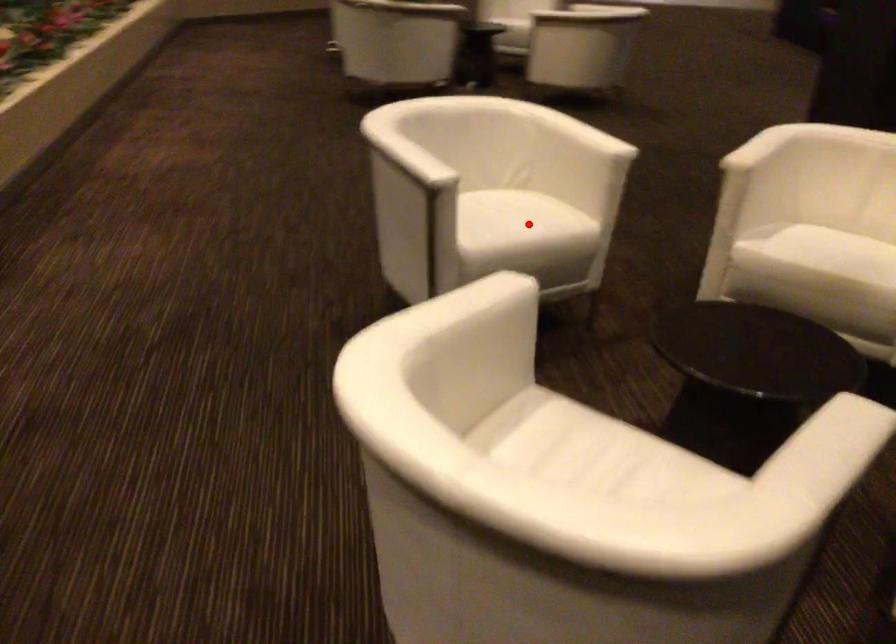
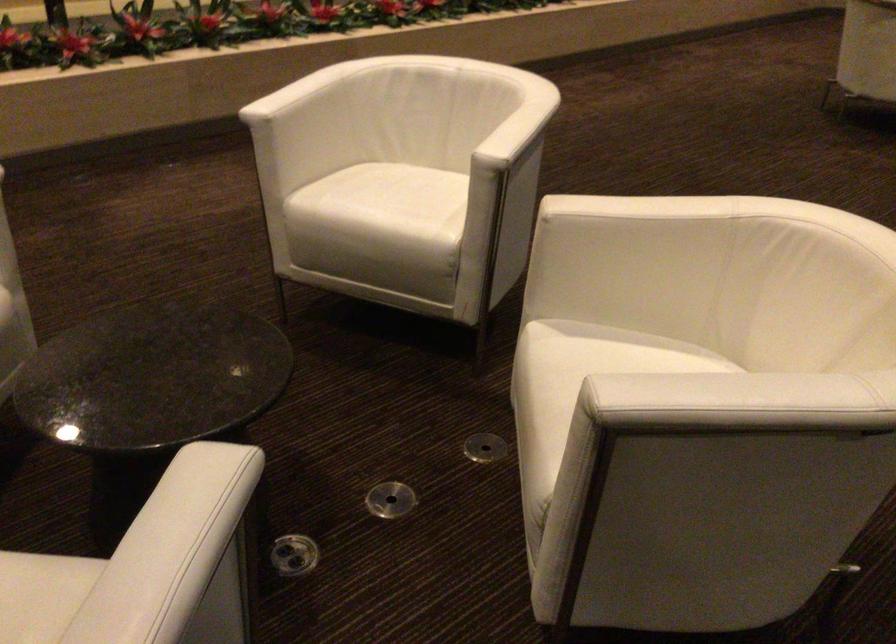
Question: A red point is marked in image1. In image2, is the corresponding 3D point closer to the camera or farther? Reply with the corresponding letter.

Choices:
 (A) The corresponding 3D point is closer.
 (B) The corresponding 3D point is farther.

Answer: (A)